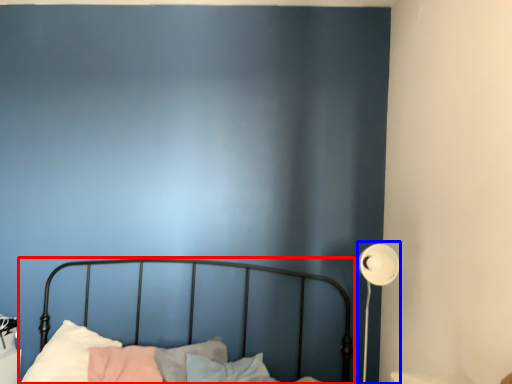
Question: Which of the following is the farthest to the observer, bed (highlighted by a red box) or lamp (highlighted by a blue box)?

Choices:
 (A) bed
 (B) lamp

Answer: (B)